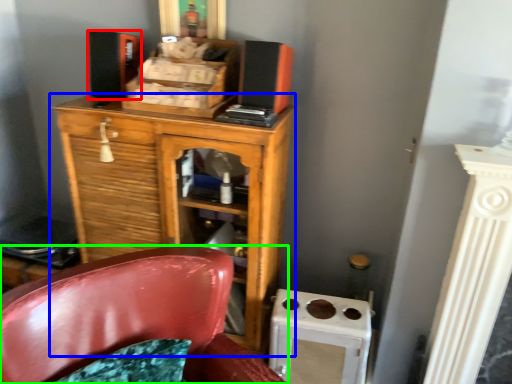
Question: Which is nearer to the speaker (highlighted by a red box)? chest of drawers (highlighted by a blue box) or chair (highlighted by a green box).

Choices:
 (A) chest of drawers
 (B) chair

Answer: (A)